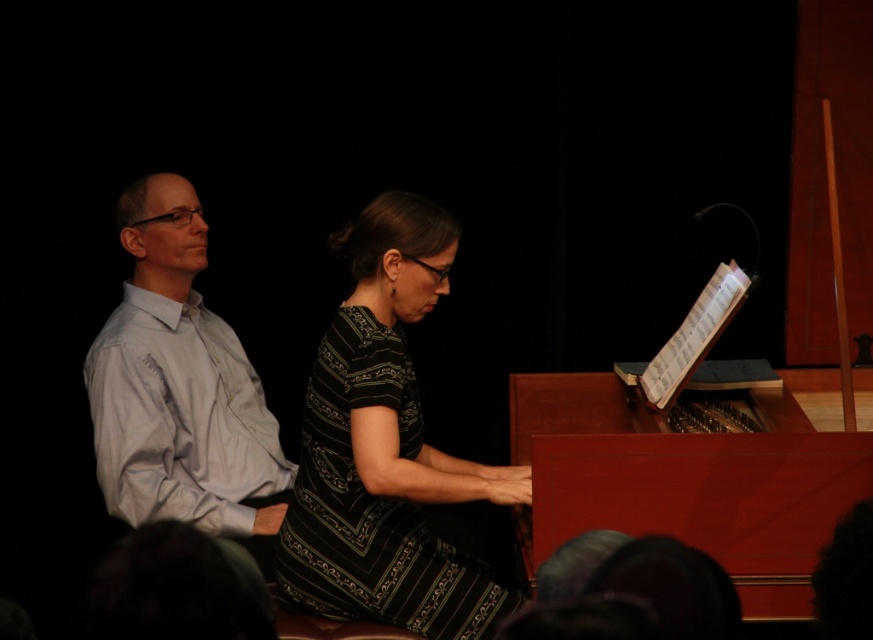
Question: Does striped fabric dress at center have a smaller size compared to white smooth shirt at left?

Choices:
 (A) no
 (B) yes

Answer: (B)

Question: Is mahogany polished piano at center above white smooth shirt at left?

Choices:
 (A) no
 (B) yes

Answer: (A)

Question: Based on their relative distances, which object is farther from the white smooth shirt at left?

Choices:
 (A) mahogany polished piano at center
 (B) striped fabric dress at center

Answer: (A)

Question: Can you confirm if striped fabric dress at center is positioned below mahogany polished piano at center?

Choices:
 (A) no
 (B) yes

Answer: (A)

Question: Which object is positioned closest to the white smooth shirt at left?

Choices:
 (A) striped fabric dress at center
 (B) mahogany polished piano at center

Answer: (A)

Question: Estimate the real-world distances between objects in this image. Which object is closer to the striped fabric dress at center?

Choices:
 (A) mahogany polished piano at center
 (B) white smooth shirt at left

Answer: (A)